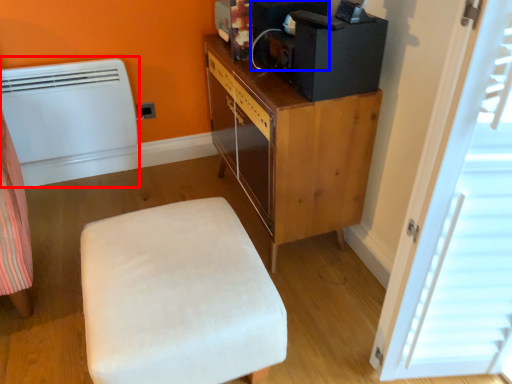
Question: Which point is closer to the camera, heater (highlighted by a red box) or appliance (highlighted by a blue box)?

Choices:
 (A) heater
 (B) appliance

Answer: (B)